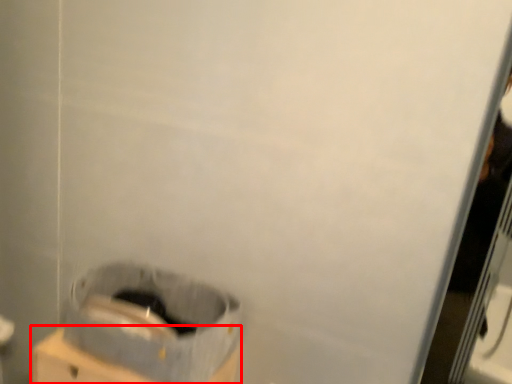
Question: Considering the relative positions of cardboard box (annotated by the red box) and waste container in the image provided, where is cardboard box (annotated by the red box) located with respect to the staircase?

Choices:
 (A) right
 (B) left

Answer: (B)